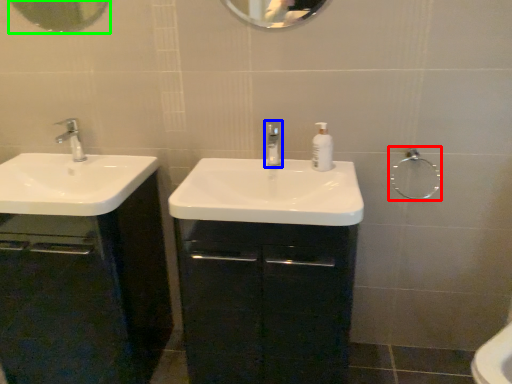
Question: Estimate the real-world distances between objects in this image. Which object is farther from shower (highlighted by a red box), tap (highlighted by a blue box) or mirror (highlighted by a green box)?

Choices:
 (A) tap
 (B) mirror

Answer: (B)